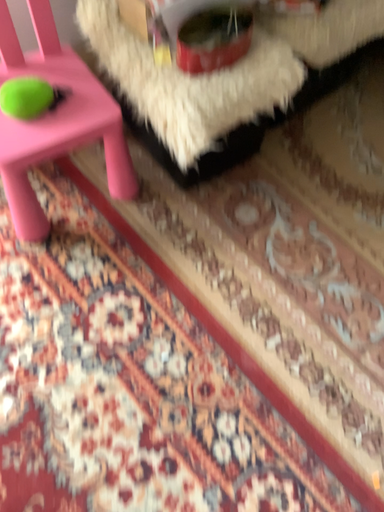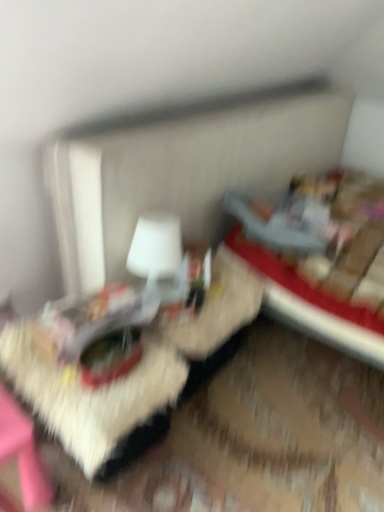
Question: How did the camera likely rotate when shooting the video?

Choices:
 (A) rotated upward
 (B) rotated downward

Answer: (A)